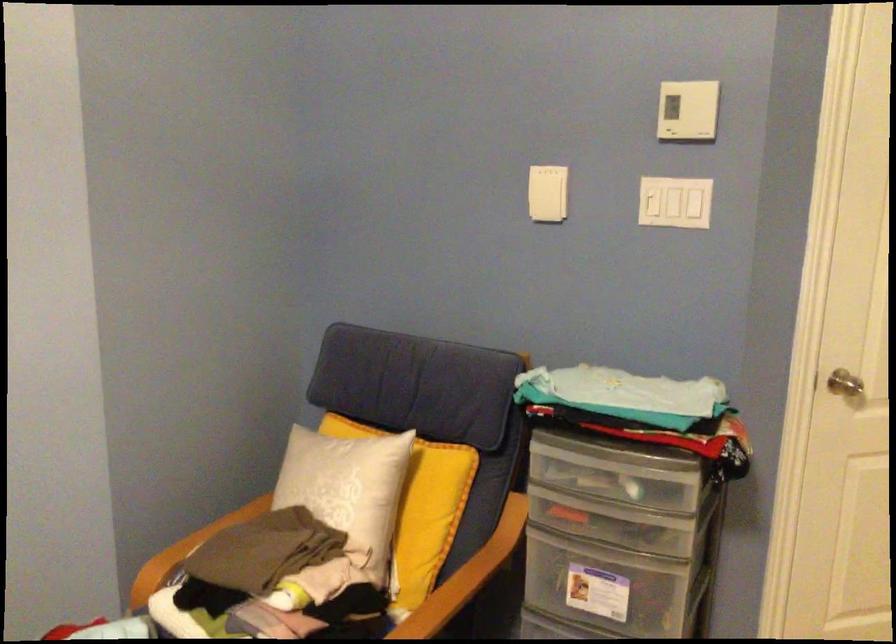
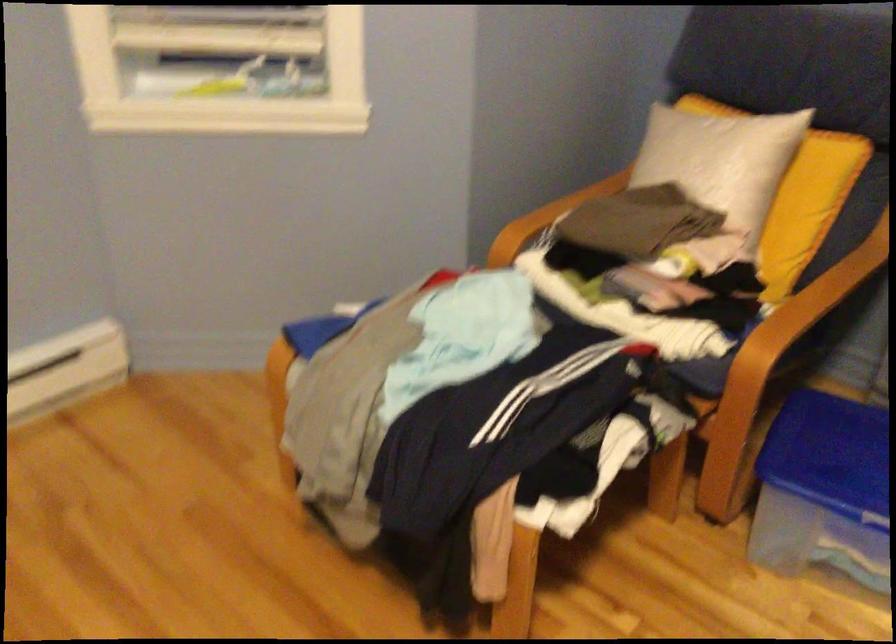
Question: Which direction would the cameraman need to move to produce the second image? Reply with the corresponding letter.

Choices:
 (A) Left
 (B) Right
 (C) Forward
 (D) Backward

Answer: (A)